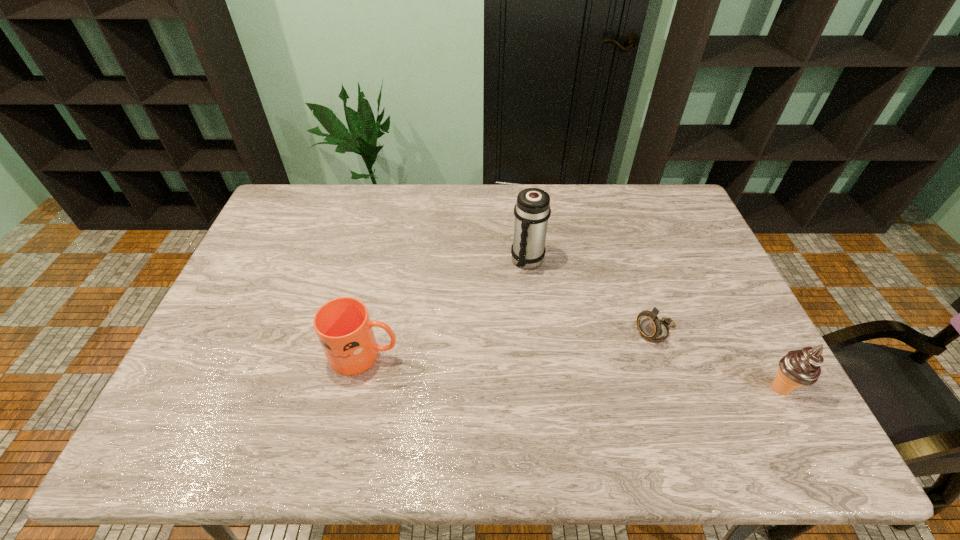
Identify which object is the nearest to the farthest object. Please provide its 2D coordinates. Your answer should be formatted as a tuple, i.e. [(x, y)], where the tuple contains the x and y coordinates of a point satisfying the conditions above.

[(653, 329)]

Find the location of a particular element. This screenshot has width=960, height=540. vacant space that satisfies the following two spatial constraints: 1. on the front side of the third object from left to right; 2. on the right side of the icecream is located at coordinates (675, 389).

This screenshot has width=960, height=540. I want to click on free spot that satisfies the following two spatial constraints: 1. on the front side of the tallest object; 2. on the right side of the icecream, so click(x=541, y=389).